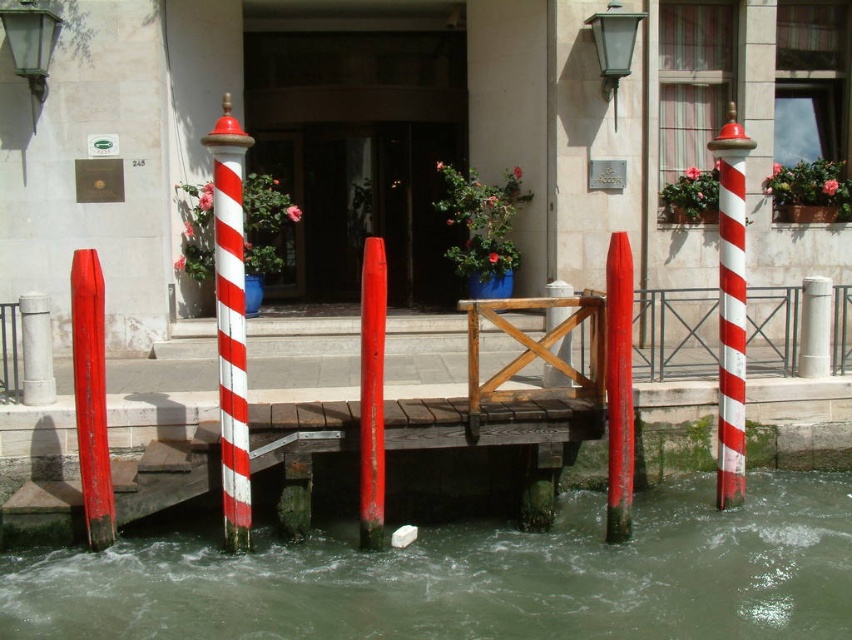
Who is higher up, red matte pole at center or white smooth pillar at center?

white smooth pillar at center is above.

What do you see at coordinates (619, 387) in the screenshot?
I see `red matte pole at center` at bounding box center [619, 387].

Who is more distant from viewer, (619, 480) or (812, 310)?

Positioned behind is point (812, 310).

Find the location of `red matte pole at center`. red matte pole at center is located at coordinates (619, 387).

Does greenish murky water at lower center have a greater width compared to smooth wooden post at center?

Indeed, greenish murky water at lower center has a greater width compared to smooth wooden post at center.

Is greenish murky water at lower center smaller than smooth wooden post at center?

No, greenish murky water at lower center is not smaller than smooth wooden post at center.

What do you see at coordinates (475, 577) in the screenshot? The image size is (852, 640). I see `greenish murky water at lower center` at bounding box center [475, 577].

Where is `greenish murky water at lower center`? The image size is (852, 640). greenish murky water at lower center is located at coordinates (475, 577).

Is smooth red post at lower left further to camera compared to smooth red post at center?

Yes, smooth red post at lower left is further from the viewer.

What do you see at coordinates (91, 396) in the screenshot?
I see `smooth red post at lower left` at bounding box center [91, 396].

Find the location of a particular element. The width and height of the screenshot is (852, 640). smooth red post at lower left is located at coordinates (91, 396).

Where is `smooth red post at lower left`? Image resolution: width=852 pixels, height=640 pixels. smooth red post at lower left is located at coordinates (91, 396).